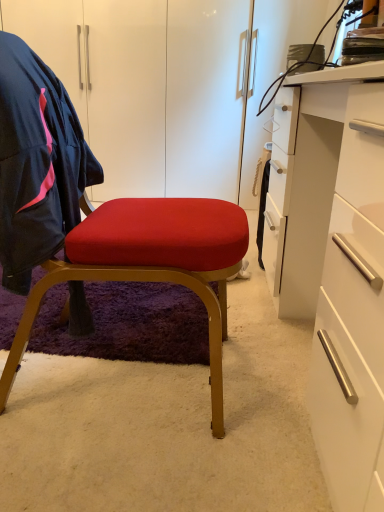
Question: Is navy blue fabric jacket at left aimed at velvet red cushion at center?

Choices:
 (A) yes
 (B) no

Answer: (A)

Question: From a real-world perspective, is navy blue fabric jacket at left located beneath velvet red cushion at center?

Choices:
 (A) no
 (B) yes

Answer: (A)

Question: From the image's perspective, is navy blue fabric jacket at left under velvet red cushion at center?

Choices:
 (A) no
 (B) yes

Answer: (A)

Question: Is navy blue fabric jacket at left to the right of velvet red cushion at center from the viewer's perspective?

Choices:
 (A) yes
 (B) no

Answer: (B)

Question: Would you say velvet red cushion at center is part of navy blue fabric jacket at left's contents?

Choices:
 (A) no
 (B) yes

Answer: (B)

Question: Is navy blue fabric jacket at left taller or shorter than white glossy desk at right?

Choices:
 (A) tall
 (B) short

Answer: (B)

Question: Is navy blue fabric jacket at left spatially inside white glossy desk at right, or outside of it?

Choices:
 (A) outside
 (B) inside

Answer: (A)

Question: In terms of width, does navy blue fabric jacket at left look wider or thinner when compared to white glossy desk at right?

Choices:
 (A) thin
 (B) wide

Answer: (A)

Question: From the image's perspective, relative to white glossy desk at right, is navy blue fabric jacket at left above or below?

Choices:
 (A) below
 (B) above

Answer: (B)

Question: Is white glossy desk at right to the left or to the right of navy blue fabric jacket at left in the image?

Choices:
 (A) left
 (B) right

Answer: (B)

Question: Relative to navy blue fabric jacket at left, is white glossy desk at right in front or behind?

Choices:
 (A) front
 (B) behind

Answer: (A)

Question: From a real-world perspective, is white glossy desk at right physically located above or below navy blue fabric jacket at left?

Choices:
 (A) above
 (B) below

Answer: (B)

Question: Considering the positions of white glossy desk at right and navy blue fabric jacket at left in the image, is white glossy desk at right wider or thinner than navy blue fabric jacket at left?

Choices:
 (A) wide
 (B) thin

Answer: (A)

Question: In the image, is velvet red cushion at center on the left side or the right side of white glossy desk at right?

Choices:
 (A) left
 (B) right

Answer: (A)

Question: Is velvet red cushion at center bigger or smaller than white glossy desk at right?

Choices:
 (A) small
 (B) big

Answer: (A)